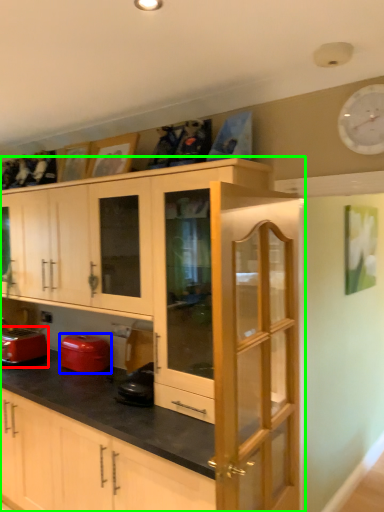
Question: Based on their relative distances, which object is farther from home appliance (highlighted by a red box)? Choose from appliance (highlighted by a blue box) and cabinetry (highlighted by a green box).

Choices:
 (A) appliance
 (B) cabinetry

Answer: (B)